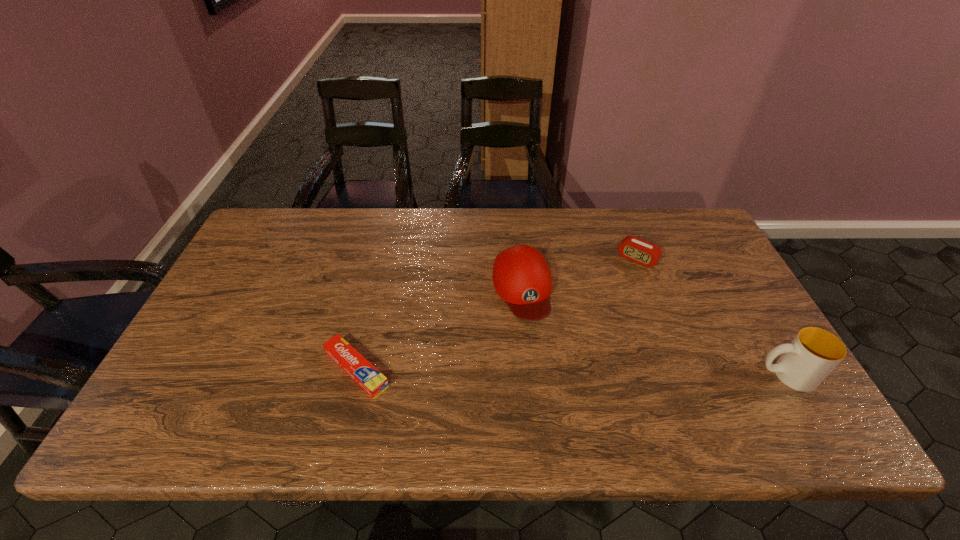
The width and height of the screenshot is (960, 540). In order to click on the leftmost object in this screenshot , I will do `click(351, 361)`.

Locate an element on the screen. This screenshot has height=540, width=960. toothpaste is located at coordinates (351, 361).

This screenshot has width=960, height=540. I want to click on cup, so click(813, 354).

Identify the location of the third tallest object. (635, 249).

You are a GUI agent. You are given a task and a screenshot of the screen. Output one action in this format:
    pyautogui.click(x=<x>, y=<y>)
    Task: Click on the third object from left to right
    The width and height of the screenshot is (960, 540).
    Given the screenshot: What is the action you would take?
    pyautogui.click(x=635, y=249)

The width and height of the screenshot is (960, 540). Identify the location of the second object from left to right. (521, 276).

What are the coordinates of `vacant area situated 0.060m on the left of the leftmost object` in the screenshot? It's located at (296, 369).

Locate an element on the screen. vacant area situated 0.200m with the handle on the side of the cup is located at coordinates (671, 375).

Locate an element on the screen. The width and height of the screenshot is (960, 540). free space located 0.050m with the handle on the side of the cup is located at coordinates (734, 375).

Identify the location of free space located 0.370m with the handle on the side of the cup. (600, 375).